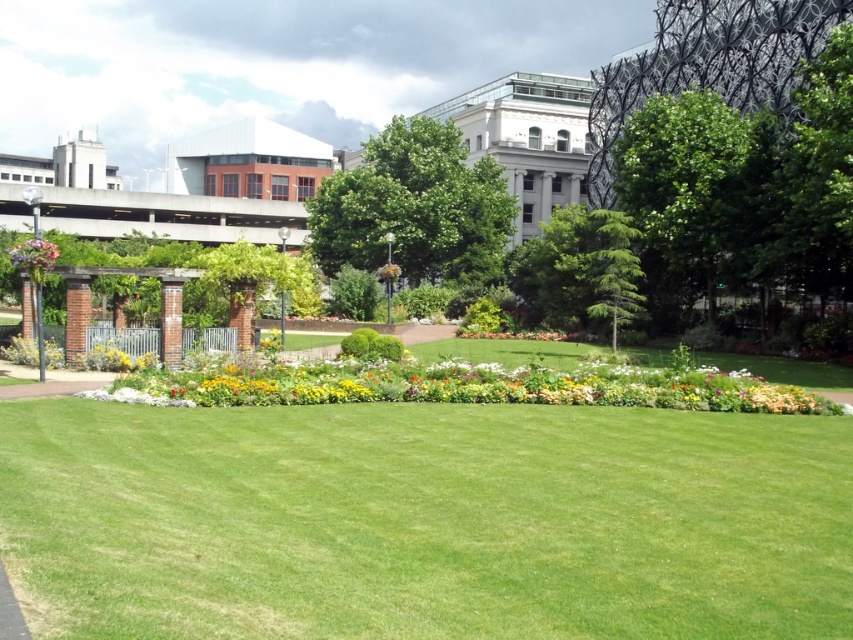
Does point (474, 538) come in front of point (689, 93)?

Yes, point (474, 538) is in front of point (689, 93).

From the picture: Does green smooth lawn at center have a larger size compared to green leafy tree at right?

No.

Find the location of a particular element. green smooth lawn at center is located at coordinates (424, 522).

The height and width of the screenshot is (640, 853). What are the coordinates of `green smooth lawn at center` in the screenshot? It's located at (424, 522).

Does green smooth lawn at center appear on the right side of green leafy tree at center?

No, green smooth lawn at center is not to the right of green leafy tree at center.

I want to click on green smooth lawn at center, so click(x=424, y=522).

Find the location of a particular element. green smooth lawn at center is located at coordinates (424, 522).

Is green smooth lawn at center positioned behind pink fabric flower at left?

No, it is not.

Who is taller, green smooth lawn at center or pink fabric flower at left?

With more height is pink fabric flower at left.

Is point (830, 444) more distant than point (42, 273)?

No, it is in front of (42, 273).

The width and height of the screenshot is (853, 640). Find the location of `green smooth lawn at center`. green smooth lawn at center is located at coordinates (424, 522).